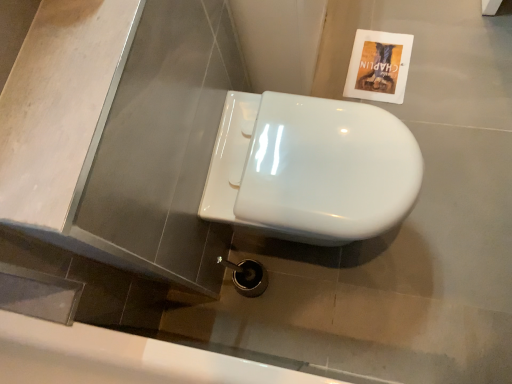
This screenshot has height=384, width=512. What are the coordinates of `free location in front of white glossy toilet at center` in the screenshot? It's located at (379, 307).